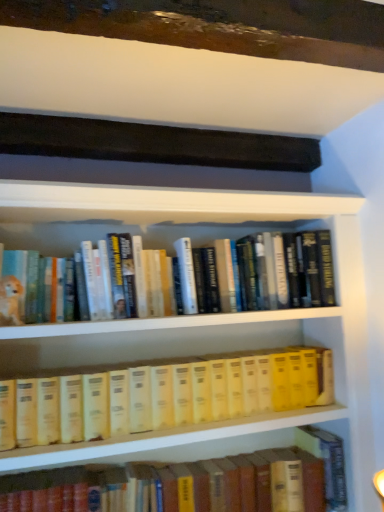
Question: Is yellow hardcover books at center, the first book positioned from the top, not within hardcover book at center, the second book from the top?

Choices:
 (A) no
 (B) yes

Answer: (B)

Question: From a real-world perspective, is yellow hardcover books at center, the first book positioned from the top, located beneath hardcover book at center, which is the 1th book in bottom-to-top order?

Choices:
 (A) yes
 (B) no

Answer: (B)

Question: Can you confirm if yellow hardcover books at center, which is counted as the second book, starting from the bottom, is shorter than hardcover book at center, which is the 1th book in bottom-to-top order?

Choices:
 (A) no
 (B) yes

Answer: (B)

Question: Does yellow hardcover books at center, which is counted as the second book, starting from the bottom, come in front of hardcover book at center, the second book from the top?

Choices:
 (A) yes
 (B) no

Answer: (A)

Question: Considering the relative sizes of yellow hardcover books at center, the first book positioned from the top, and hardcover book at center, the second book from the top, in the image provided, is yellow hardcover books at center, the first book positioned from the top, smaller than hardcover book at center, the second book from the top,?

Choices:
 (A) no
 (B) yes

Answer: (A)

Question: Considering the relative positions of yellow hardcover books at center, which is counted as the second book, starting from the bottom, and hardcover book at center, the second book from the top, in the image provided, is yellow hardcover books at center, which is counted as the second book, starting from the bottom, to the left of hardcover book at center, the second book from the top, from the viewer's perspective?

Choices:
 (A) yes
 (B) no

Answer: (A)

Question: Is hardcover book at center, which is the 1th book in bottom-to-top order, to the right of yellow hardcover books at center, the first book positioned from the top, from the viewer's perspective?

Choices:
 (A) yes
 (B) no

Answer: (A)

Question: Does hardcover book at center, which is the 1th book in bottom-to-top order, come behind yellow hardcover books at center, the first book positioned from the top?

Choices:
 (A) no
 (B) yes

Answer: (B)

Question: From the image's perspective, is hardcover book at center, the second book from the top, on top of yellow hardcover books at center, which is counted as the second book, starting from the bottom?

Choices:
 (A) yes
 (B) no

Answer: (B)

Question: Could you tell me if hardcover book at center, which is the 1th book in bottom-to-top order, is facing yellow hardcover books at center, the first book positioned from the top?

Choices:
 (A) yes
 (B) no

Answer: (B)

Question: Is hardcover book at center, which is the 1th book in bottom-to-top order, to the left of yellow hardcover books at center, which is counted as the second book, starting from the bottom, from the viewer's perspective?

Choices:
 (A) no
 (B) yes

Answer: (A)

Question: Can you confirm if hardcover book at center, which is the 1th book in bottom-to-top order, is bigger than yellow hardcover books at center, which is counted as the second book, starting from the bottom?

Choices:
 (A) no
 (B) yes

Answer: (A)

Question: From the image's perspective, is yellow hardcover books at center, which is counted as the second book, starting from the bottom, located above or below hardcover book at center, which is the 1th book in bottom-to-top order?

Choices:
 (A) below
 (B) above

Answer: (B)